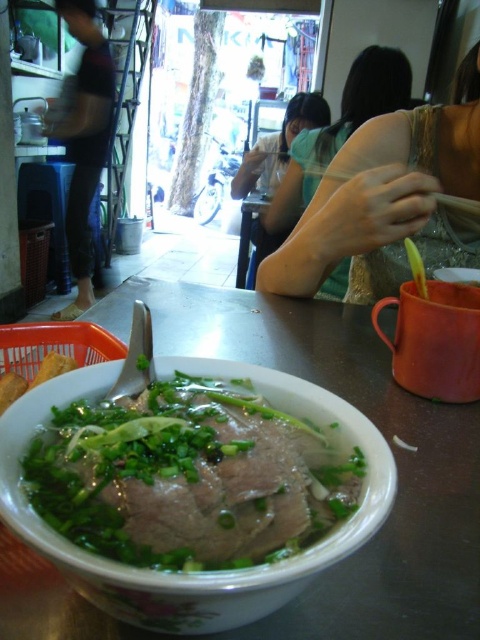
Question: Which is nearer to the white glossy stew at center?

Choices:
 (A) yellow rubber spoon at upper right
 (B) dark blue jeans at left
 (C) wooden chopsticks at upper right
 (D) green fabric shirt at upper right

Answer: (A)

Question: Does white glossy bowl at center have a greater width compared to yellow rubber spoon at upper right?

Choices:
 (A) no
 (B) yes

Answer: (B)

Question: Which object is farther from the camera taking this photo?

Choices:
 (A) white glossy stew at center
 (B) wooden chopsticks at upper right
 (C) green fabric shirt at upper right
 (D) white glossy bowl at center

Answer: (B)

Question: Does white glossy stew at center have a larger size compared to wooden chopsticks at upper right?

Choices:
 (A) yes
 (B) no

Answer: (B)

Question: Which point appears closest to the camera in this image?

Choices:
 (A) (82, 148)
 (B) (151, 477)
 (C) (459, 532)
 (D) (404, 241)

Answer: (B)

Question: Can you confirm if white glossy bowl at center is positioned to the right of green fabric shirt at upper right?

Choices:
 (A) yes
 (B) no

Answer: (B)